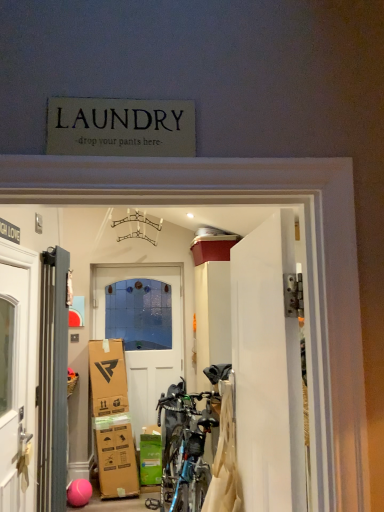
Question: From a real-world perspective, is metallic gray radiator at left, placed as the 2th door when sorted from front to back, below green cardboard box at lower center?

Choices:
 (A) no
 (B) yes

Answer: (A)

Question: Does metallic gray radiator at left, the third door when ordered from right to left, have a greater height compared to green cardboard box at lower center?

Choices:
 (A) no
 (B) yes

Answer: (B)

Question: Is metallic gray radiator at left, the third door when ordered from right to left, wider than green cardboard box at lower center?

Choices:
 (A) no
 (B) yes

Answer: (A)

Question: Would you say metallic gray radiator at left, positioned as the 2th door in back-to-front order, contains green cardboard box at lower center?

Choices:
 (A) no
 (B) yes

Answer: (A)

Question: Is metallic gray radiator at left, the 1th door positioned from the left, with green cardboard box at lower center?

Choices:
 (A) yes
 (B) no

Answer: (B)

Question: Visually, is green cardboard box at lower center positioned to the left or to the right of white glossy door at center, the third door from the back?

Choices:
 (A) left
 (B) right

Answer: (A)

Question: From the image's perspective, is green cardboard box at lower center above or below white glossy door at center, the third door from the back?

Choices:
 (A) below
 (B) above

Answer: (A)

Question: Considering the positions of green cardboard box at lower center and white glossy door at center, placed as the 3th door when sorted from left to right, in the image, is green cardboard box at lower center wider or thinner than white glossy door at center, placed as the 3th door when sorted from left to right,?

Choices:
 (A) thin
 (B) wide

Answer: (B)

Question: Is point (147, 437) positioned closer to the camera than point (253, 493)?

Choices:
 (A) farther
 (B) closer

Answer: (A)

Question: In terms of width, does white wooden door at center, which is the third door from front to back, look wider or thinner when compared to white glossy door at center, placed as the 3th door when sorted from left to right?

Choices:
 (A) thin
 (B) wide

Answer: (B)

Question: From a real-world perspective, is white wooden door at center, placed as the 2th door when sorted from left to right, positioned above or below white glossy door at center, positioned as the first door in right-to-left order?

Choices:
 (A) above
 (B) below

Answer: (B)

Question: Considering the relative positions of white wooden door at center, which ranks as the 1th door in back-to-front order, and white glossy door at center, the third door from the back, in the image provided, is white wooden door at center, which ranks as the 1th door in back-to-front order, to the left or to the right of white glossy door at center, the third door from the back,?

Choices:
 (A) right
 (B) left

Answer: (B)

Question: Is white wooden door at center, which ranks as the 1th door in back-to-front order, inside the boundaries of white glossy door at center, which ranks as the first door in front-to-back order, or outside?

Choices:
 (A) outside
 (B) inside

Answer: (A)

Question: Relative to white wooden door at center, which is the third door from front to back, is metallic gray radiator at left, the third door when ordered from right to left, in front or behind?

Choices:
 (A) front
 (B) behind

Answer: (A)

Question: From their relative heights in the image, would you say metallic gray radiator at left, the 1th door positioned from the left, is taller or shorter than white wooden door at center, which ranks as the 1th door in back-to-front order?

Choices:
 (A) tall
 (B) short

Answer: (B)